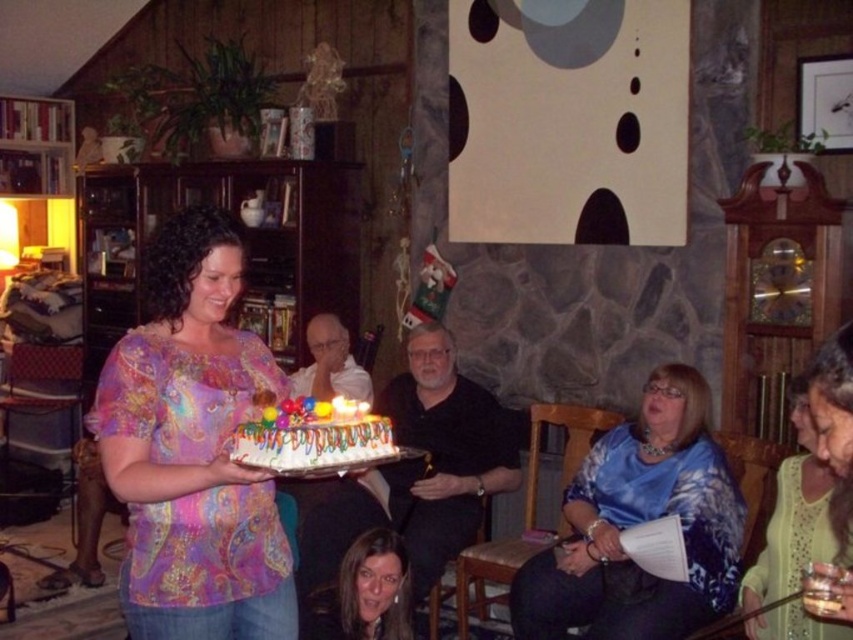
Does point (103, 385) come behind point (369, 452)?

Yes, point (103, 385) is farther from viewer.

Locate an element on the screen. Image resolution: width=853 pixels, height=640 pixels. multicolored paisley shirt at center is located at coordinates (193, 448).

Can you confirm if blue floral blouse at center is positioned to the left of smooth brown hair at lower center?

In fact, blue floral blouse at center is to the right of smooth brown hair at lower center.

Image resolution: width=853 pixels, height=640 pixels. In order to click on blue floral blouse at center in this screenshot , I will do `click(637, 522)`.

Is point (590, 518) farther from viewer compared to point (332, 408)?

Yes, it is behind point (332, 408).

From the picture: Between blue floral blouse at center and white frosted cake with colorful decorations at center, which one appears on the left side from the viewer's perspective?

Positioned to the left is white frosted cake with colorful decorations at center.

Where is `blue floral blouse at center`? This screenshot has height=640, width=853. blue floral blouse at center is located at coordinates (637, 522).